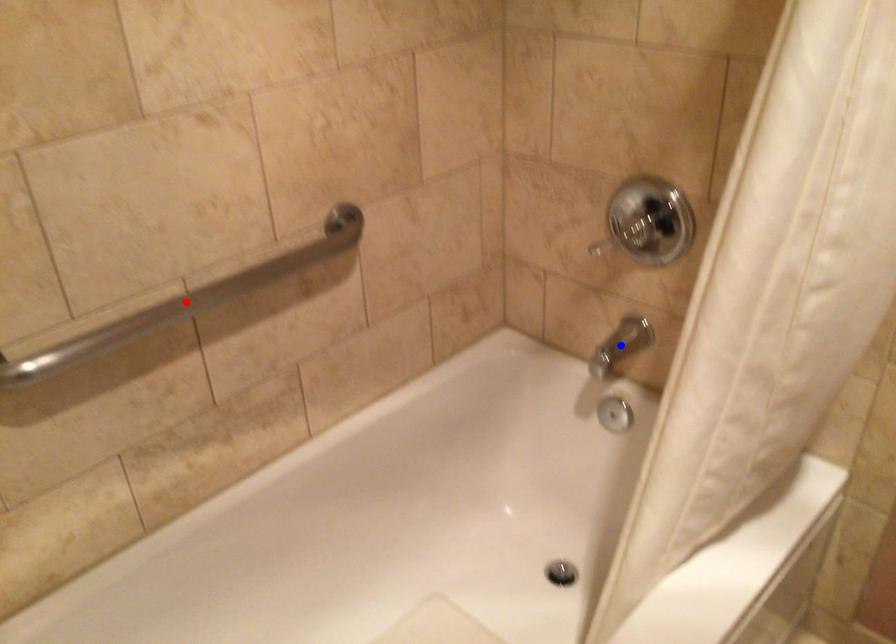
Question: Two points are marked on the image. Which point is closer to the camera?

Choices:
 (A) Blue point is closer.
 (B) Red point is closer.

Answer: (B)